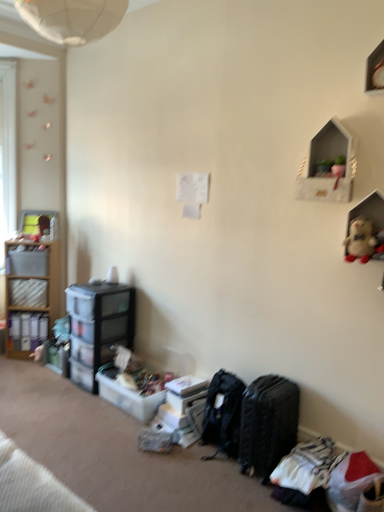
Question: Considering the positions of black textured suitcase at lower right and matte plastic shelves at left, arranged as the 3th shelf when viewed from the front, in the image, is black textured suitcase at lower right bigger or smaller than matte plastic shelves at left, arranged as the 3th shelf when viewed from the front,?

Choices:
 (A) big
 (B) small

Answer: (B)

Question: In the image, is black textured suitcase at lower right on the left side or the right side of matte plastic shelves at left, which is counted as the 3th shelf, starting from the right?

Choices:
 (A) right
 (B) left

Answer: (A)

Question: Considering the real-world distances, which object is farthest from the fluffy beige stuffed animal at upper right?

Choices:
 (A) matte black storage box at left, which ranks as the first storage box in top-to-bottom order
 (B) white matte shelf at upper right, acting as the 3th shelf starting from the left
 (C) black textured suitcase at lower right
 (D) matte plastic shelves at left, which appears as the 1th shelf when viewed from the back
 (E) transparent plastic storage at lower left, which is counted as the 2th shelf, starting from the right

Answer: (D)

Question: Estimate the real-world distances between objects in this image. Which object is closer to the plastic storage box at lower center, the third storage box positioned from the top?

Choices:
 (A) matte black storage box at left, which ranks as the first storage box in top-to-bottom order
 (B) black textured suitcase at lower right
 (C) matte plastic storage box at left, arranged as the 4th storage box when viewed from the right
 (D) translucent plastic storage box at lower center, the fourth storage box in the top-to-bottom sequence
 (E) white matte shelf at upper right, acting as the 3th shelf starting from the left

Answer: (D)